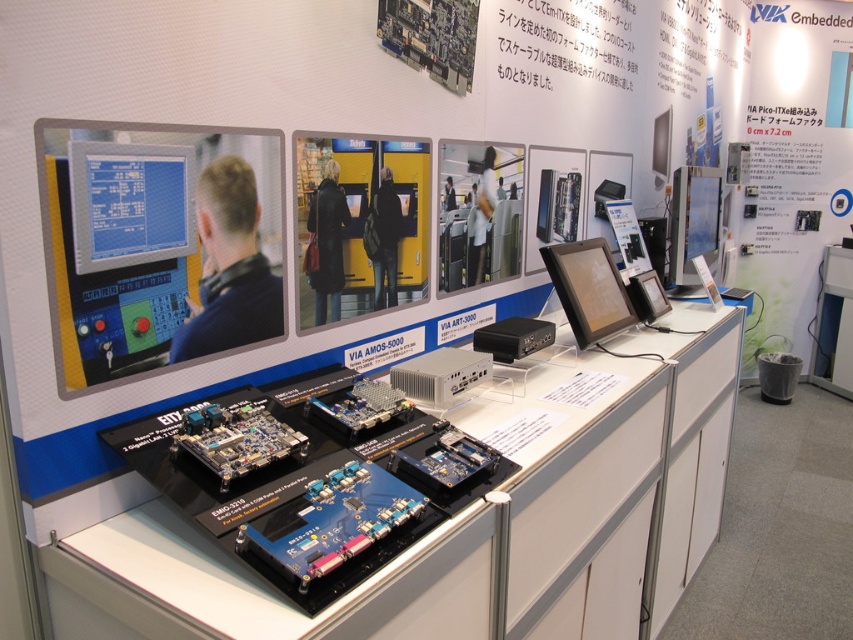
Question: Which object appears farthest from the camera in this image?

Choices:
 (A) blue glossy monitor at upper left
 (B) white paper at upper right
 (C) matte black shirt at center

Answer: (B)

Question: Is matte black monitor at upper right to the right of white matte jacket at center from the viewer's perspective?

Choices:
 (A) yes
 (B) no

Answer: (A)

Question: Is white paper at upper right to the left of blue circuit board at center from the viewer's perspective?

Choices:
 (A) yes
 (B) no

Answer: (B)

Question: Which object is closer to the camera taking this photo?

Choices:
 (A) matte black shirt at center
 (B) blue circuit board at center
 (C) matte black monitor at upper right
 (D) white matte jacket at center

Answer: (B)

Question: Which of the following is the closest to the observer?

Choices:
 (A) blue circuit board at center
 (B) white paper at upper right

Answer: (A)

Question: Does blue glossy monitor at upper left come in front of white matte jacket at center?

Choices:
 (A) no
 (B) yes

Answer: (B)